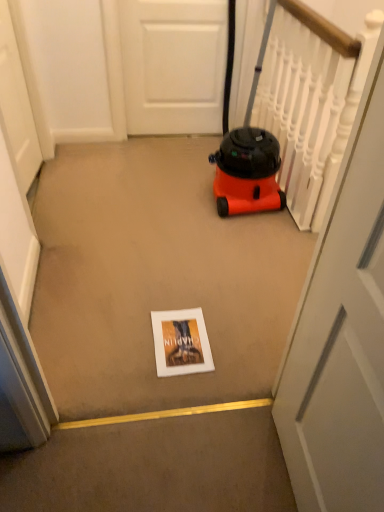
You are a GUI agent. You are given a task and a screenshot of the screen. Output one action in this format:
    pyautogui.click(x=<x>, y=<y>)
    Task: Click on the vacant space that is to the left of orange matte vacuum cleaner at center-right
    
    Given the screenshot: What is the action you would take?
    pyautogui.click(x=129, y=177)